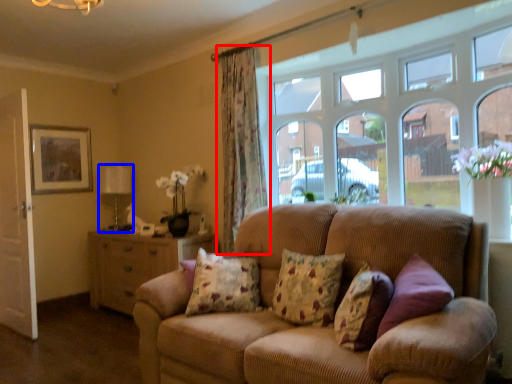
Question: Which point is closer to the camera, curtain (highlighted by a red box) or lamp (highlighted by a blue box)?

Choices:
 (A) curtain
 (B) lamp

Answer: (A)